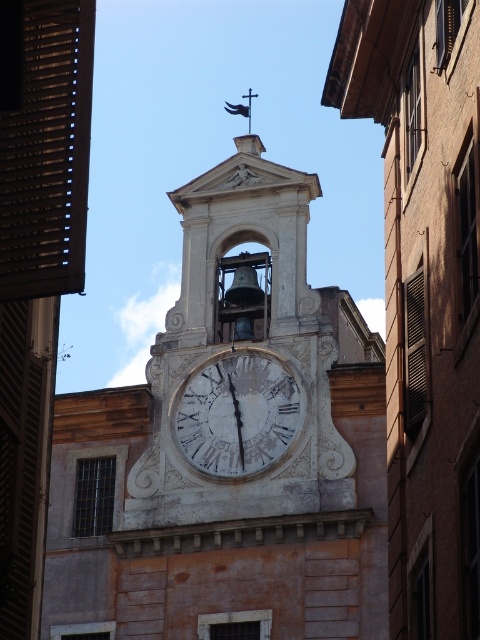
You are standing in front of a building with two clocks. You see the white stone clock at center and the white marble clock at center. Which one is more to the right?

The white stone clock at center is positioned on the right side of the white marble clock at center, so it is more to the right.

In the scene shown: You are an architect designing a new building and want to place a 5 meter wide statue between the white stone clock at center and the white marble clock at center. Will there be enough space between them to fit the statue?

The distance between the white stone clock at center and the white marble clock at center is 6.29 meters. Since the statue is 5 meters wide, there is enough space to fit it between them as 5 meters is less than 6.29 meters.

Based on the photo, you are an architect designing a model of this building. You have two clocks to choose from. The white stone clock at center and the white marble clock at center. Which one should you use if you want the clock to be the most prominent feature in your model?

The white stone clock at center has a larger size compared to the white marble clock at center, so you should use the white stone clock at center to make the clock the most prominent feature in the model.